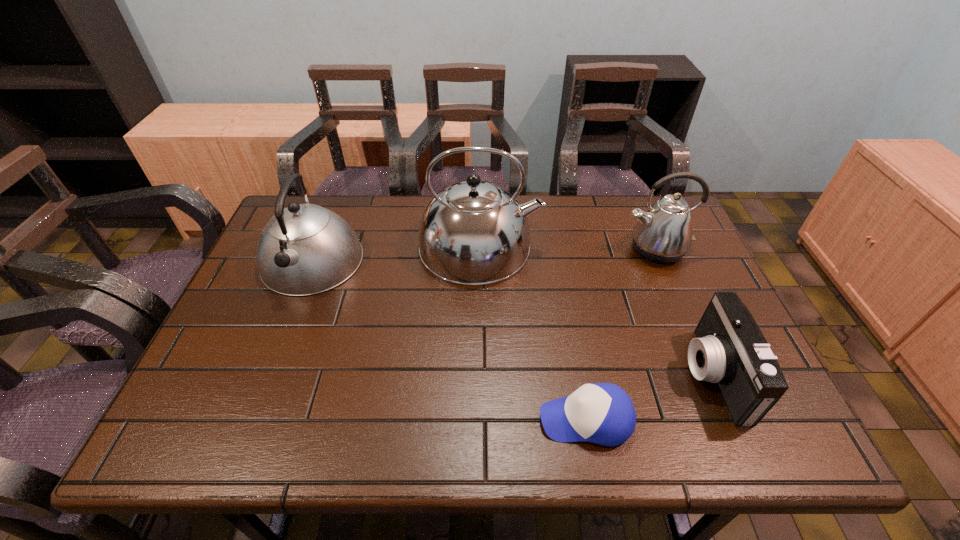
You are a GUI agent. You are given a task and a screenshot of the screen. Output one action in this format:
    pyautogui.click(x=<x>, y=<y>)
    Task: Click on the object at the far left corner
    
    Given the screenshot: What is the action you would take?
    pyautogui.click(x=305, y=249)

Image resolution: width=960 pixels, height=540 pixels. I want to click on object at the far right corner, so click(x=663, y=234).

Where is `object located at the near right corner`? object located at the near right corner is located at coordinates (730, 350).

This screenshot has width=960, height=540. I want to click on free space at the far edge, so click(358, 231).

You are a GUI agent. You are given a task and a screenshot of the screen. Output one action in this format:
    pyautogui.click(x=<x>, y=<y>)
    Task: Click on the vacant region at the near edge of the desktop
    
    Given the screenshot: What is the action you would take?
    pyautogui.click(x=309, y=433)

In the image, there is a desktop. Where is `vacant space at the left edge`? Image resolution: width=960 pixels, height=540 pixels. vacant space at the left edge is located at coordinates (263, 323).

You are a GUI agent. You are given a task and a screenshot of the screen. Output one action in this format:
    pyautogui.click(x=<x>, y=<y>)
    Task: Click on the vacant region at the far left corner of the desktop
    
    Given the screenshot: What is the action you would take?
    pyautogui.click(x=293, y=196)

The image size is (960, 540). Find the location of `free spot at the far right corner of the desktop`. free spot at the far right corner of the desktop is located at coordinates (668, 194).

Where is `vacant space at the near right corner of the desktop`? vacant space at the near right corner of the desktop is located at coordinates (787, 425).

I want to click on free space between the shortest object and the leftmost object, so click(448, 340).